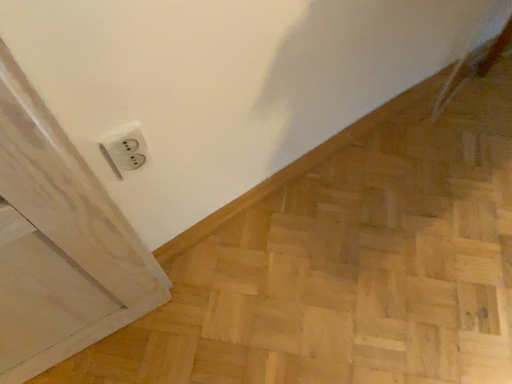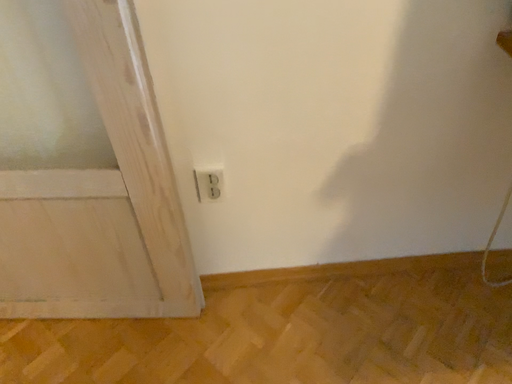
Question: Which way did the camera rotate in the video?

Choices:
 (A) rotated upward
 (B) rotated downward

Answer: (A)